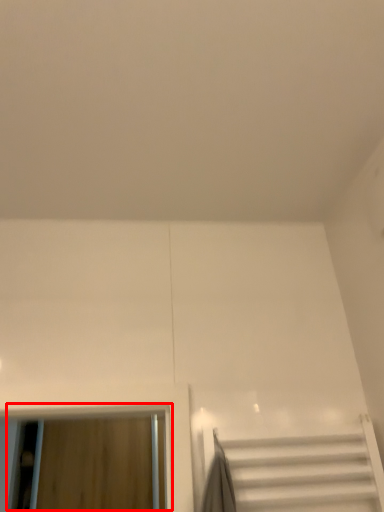
Question: Observing the image, what is the correct spatial positioning of window (annotated by the red box) in reference to stairs?

Choices:
 (A) right
 (B) left

Answer: (B)